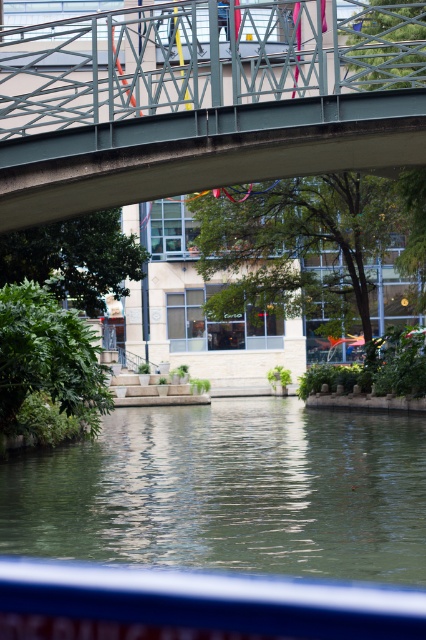
You are standing at the point marked by point (198,99) on a map of the canal area. What object are you closest to?

You are closest to the metallic gray bridge at upper center, as the point (198,99) represents its location.

You are a delivery drone carrying a package that requires a minimum of 15 meters of clearance between the metallic gray bridge at upper center and the nearest building to land safely. Can you safely land here?

The metallic gray bridge at upper center and the nearest building are 17.75 meters apart, which exceeds the required 15 meters clearance. Therefore, the drone can safely land here.

In the scene shown: You are standing on the sidewalk near the canal and want to cross to the other side. The metallic gray bridge at upper center is your only option. Can you safely walk across the bridge to reach the other side of the green smooth water at center?

Yes, the metallic gray bridge at upper center is above the green smooth water at center, so you can safely walk across the bridge to reach the other side.